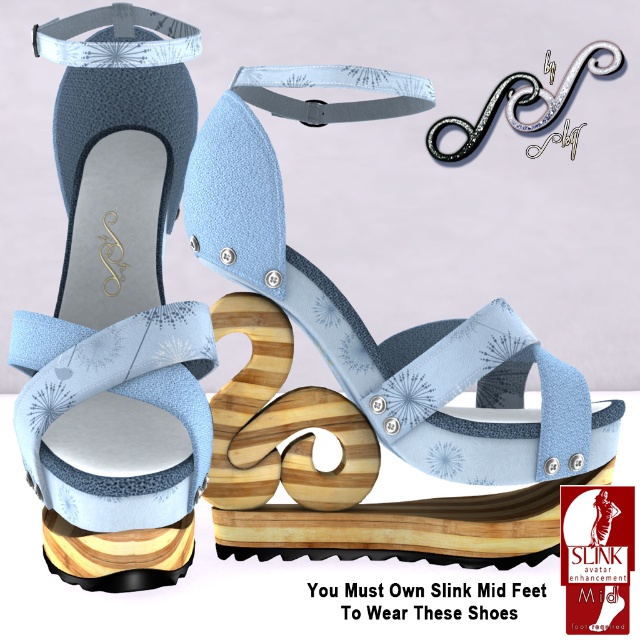
In the scene shown: You are a customer at a shoe store trying to decide between two straps on the same pair of sandals. The straps are the white textured fabric strap at upper left and the satin silver strap at upper center. Which strap is shorter?

The white textured fabric strap at upper left is shorter than the satin silver strap at upper center.

You are a shoe designer examining the image of the sandals. You need to determine which object is larger between the light blue fabric sandal at center and the white textured fabric strap at upper left. Which one is bigger?

The light blue fabric sandal at center is bigger than the white textured fabric strap at upper left.

You are examining the sandals and want to determine which of the two points, point [132,22] or point [557,97], is closer to your eyes. Based on the image, which point is nearer to you?

Point [132,22] is closer to the camera than point [557,97], so it is the point nearer to you.